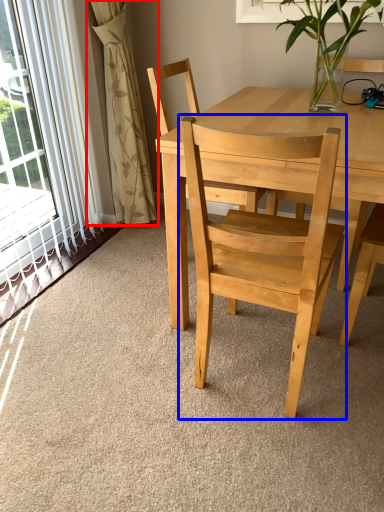
Question: Which object appears closest to the camera in this image, curtain (highlighted by a red box) or chair (highlighted by a blue box)?

Choices:
 (A) curtain
 (B) chair

Answer: (B)